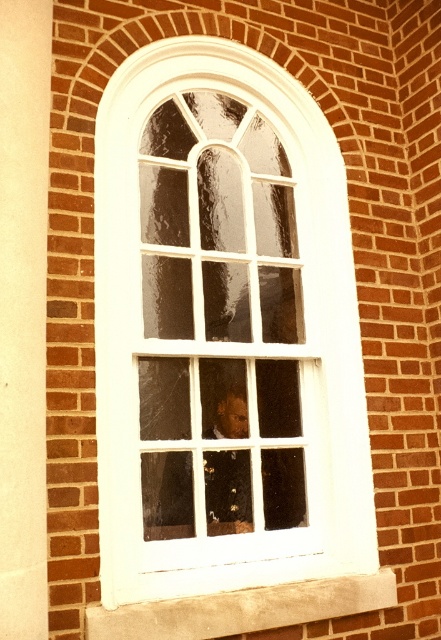
Is smooth skin face at center thinner than white concrete at lower center?

Yes, smooth skin face at center is thinner than white concrete at lower center.

Does smooth skin face at center appear under white concrete at lower center?

Actually, smooth skin face at center is above white concrete at lower center.

Is point (287, 458) positioned in front of point (288, 586)?

No, (287, 458) is behind (288, 586).

Find the location of a particular element. Image resolution: width=441 pixels, height=640 pixels. smooth skin face at center is located at coordinates (232, 456).

Can you confirm if white matte window frame at center is bigger than white concrete at lower center?

Correct, white matte window frame at center is larger in size than white concrete at lower center.

Can you confirm if white matte window frame at center is taller than white concrete at lower center?

Indeed, white matte window frame at center has a greater height compared to white concrete at lower center.

Is point (119, 518) positioned after point (276, 612)?

No, it is not.

I want to click on white matte window frame at center, so click(224, 332).

Which is below, white matte window frame at center or smooth skin face at center?

Positioned lower is smooth skin face at center.

Who is more forward, (201, 266) or (265, 490)?

Point (265, 490) is in front.

Where is `white matte window frame at center`? The height and width of the screenshot is (640, 441). white matte window frame at center is located at coordinates (224, 332).